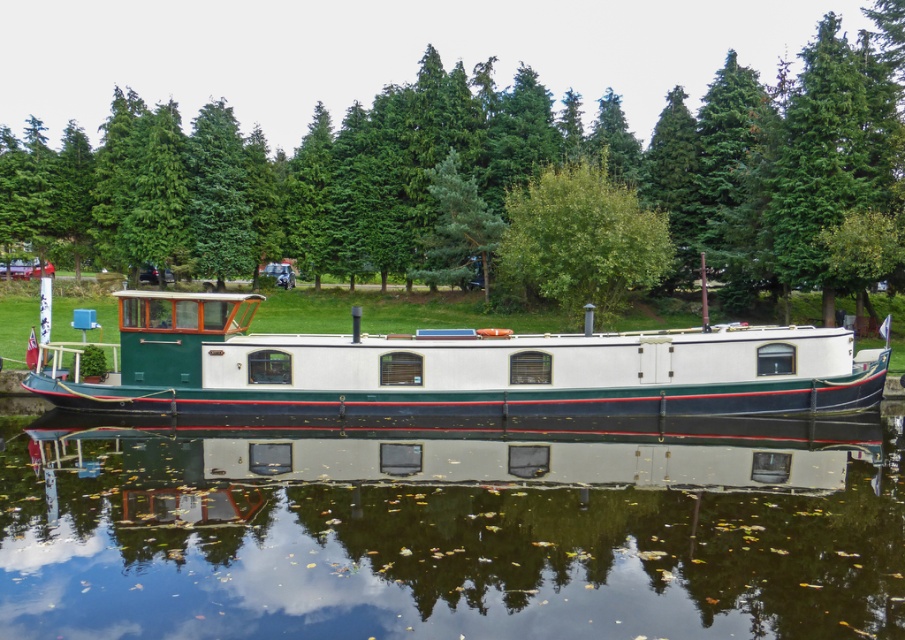
Between transparent glass water at center and green textured tree at upper center, which one is positioned lower?

transparent glass water at center

Between point (227, 566) and point (355, 154), which one is positioned in front?

Point (227, 566)

Identify the location of transparent glass water at center. The image size is (905, 640). (446, 536).

Find the location of a particular element. The height and width of the screenshot is (640, 905). transparent glass water at center is located at coordinates (446, 536).

How distant is transparent glass water at center from white glossy houseboat at center?

The distance of transparent glass water at center from white glossy houseboat at center is 4.83 meters.

Where is `transparent glass water at center`? This screenshot has height=640, width=905. transparent glass water at center is located at coordinates (446, 536).

Which is behind, point (445, 118) or point (597, 282)?

Positioned behind is point (445, 118).

Is the position of green textured tree at upper center less distant than that of green leafy tree at center?

No, green textured tree at upper center is further to the viewer.

Does point (734, 237) lie behind point (624, 257)?

That is True.

Image resolution: width=905 pixels, height=640 pixels. Identify the location of green textured tree at upper center. (607, 163).